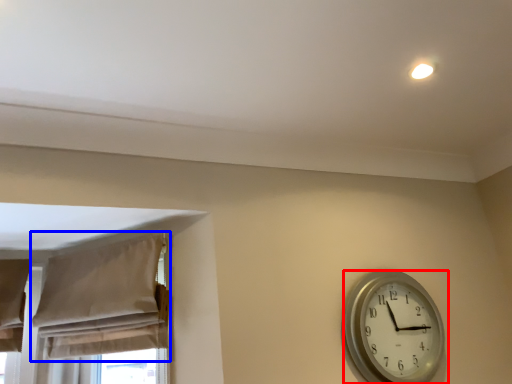
Question: Which point is closer to the camera, wall clock (highlighted by a red box) or curtain (highlighted by a blue box)?

Choices:
 (A) wall clock
 (B) curtain

Answer: (B)